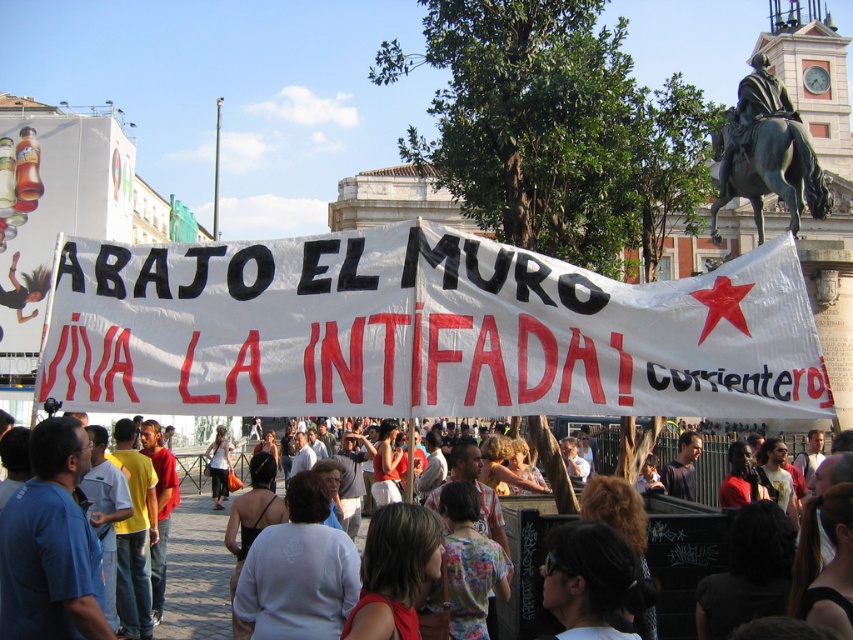
Can you confirm if white cotton shirt at center is shorter than bronze statue of man on horse at upper right?

Correct, white cotton shirt at center is not as tall as bronze statue of man on horse at upper right.

Consider the image. Can you confirm if white cotton shirt at center is positioned above bronze statue of man on horse at upper right?

Incorrect, white cotton shirt at center is not positioned above bronze statue of man on horse at upper right.

Measure the distance between white cotton shirt at center and camera.

white cotton shirt at center is 96.65 feet away from camera.

This screenshot has height=640, width=853. What are the coordinates of `white cotton shirt at center` in the screenshot? It's located at (196, 572).

Which is above, white paper banner at center or white cotton shirt at center?

white paper banner at center is higher up.

Where is `white paper banner at center`? This screenshot has height=640, width=853. white paper banner at center is located at coordinates (422, 332).

Measure the distance between point [256,355] and camera.

Point [256,355] and camera are 27.90 meters apart from each other.

Find the location of a particular element. This screenshot has height=640, width=853. white paper banner at center is located at coordinates (422, 332).

This screenshot has height=640, width=853. What are the coordinates of `white paper banner at center` in the screenshot? It's located at (422, 332).